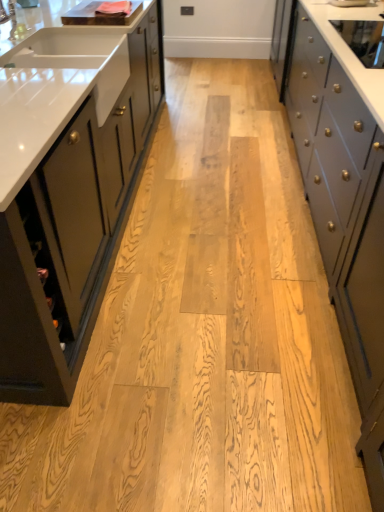
Describe the element at coordinates (67, 189) in the screenshot. I see `matte dark green cabinet at left, which ranks as the 1th cabinetry in left-to-right order` at that location.

This screenshot has height=512, width=384. What do you see at coordinates (341, 201) in the screenshot? I see `gray matte cabinet at right, acting as the second cabinetry starting from the left` at bounding box center [341, 201].

This screenshot has height=512, width=384. What are the coordinates of `silver metallic faucet at upper left` in the screenshot? It's located at (12, 23).

Looking at this image, how many degrees apart are the facing directions of matte dark green cabinet at left, the second cabinetry when ordered from right to left, and silver metallic faucet at upper left?

They differ by 2.26 degrees in their facing directions.

Is point (12, 330) less distant than point (13, 40)?

Yes, point (12, 330) is in front of point (13, 40).

I want to click on cabinetry that appears on the left of silver metallic faucet at upper left, so click(x=67, y=189).

Would you say silver metallic faucet at upper left contains gray matte cabinet at right, acting as the second cabinetry starting from the left?

That's incorrect, gray matte cabinet at right, acting as the second cabinetry starting from the left, is not inside silver metallic faucet at upper left.

Looking at this image, which is nearer, (15,32) or (280,98)?

Clearly, point (15,32) is closer to the camera than point (280,98).

From a real-world perspective, between silver metallic faucet at upper left and gray matte cabinet at right, acting as the second cabinetry starting from the left, who is vertically lower?

gray matte cabinet at right, acting as the second cabinetry starting from the left, is physically lower.

Considering the positions of objects silver metallic faucet at upper left and matte dark green cabinet at left, which ranks as the 1th cabinetry in left-to-right order, in the image provided, who is more to the left, silver metallic faucet at upper left or matte dark green cabinet at left, which ranks as the 1th cabinetry in left-to-right order,?

From the viewer's perspective, matte dark green cabinet at left, which ranks as the 1th cabinetry in left-to-right order, appears more on the left side.

Based on the photo, from a real-world perspective, is silver metallic faucet at upper left positioned over matte dark green cabinet at left, the second cabinetry when ordered from right to left, based on gravity?

Correct, in the physical world, silver metallic faucet at upper left is higher than matte dark green cabinet at left, the second cabinetry when ordered from right to left.

Between silver metallic faucet at upper left and matte dark green cabinet at left, the second cabinetry when ordered from right to left, which one has larger width?

With larger width is matte dark green cabinet at left, the second cabinetry when ordered from right to left.

Does point (8, 4) come farther from viewer compared to point (87, 94)?

Yes, it is.

Is gray matte cabinet at right, acting as the second cabinetry starting from the left, taller or shorter than matte dark green cabinet at left, which ranks as the 1th cabinetry in left-to-right order?

gray matte cabinet at right, acting as the second cabinetry starting from the left, is taller than matte dark green cabinet at left, which ranks as the 1th cabinetry in left-to-right order.

Where is `cabinetry lying on the right of matte dark green cabinet at left, which ranks as the 1th cabinetry in left-to-right order`? The height and width of the screenshot is (512, 384). cabinetry lying on the right of matte dark green cabinet at left, which ranks as the 1th cabinetry in left-to-right order is located at coordinates (341, 201).

Is gray matte cabinet at right, acting as the second cabinetry starting from the left, inside or outside of matte dark green cabinet at left, the second cabinetry when ordered from right to left?

gray matte cabinet at right, acting as the second cabinetry starting from the left, exists outside the volume of matte dark green cabinet at left, the second cabinetry when ordered from right to left.

The width and height of the screenshot is (384, 512). I want to click on cabinetry on the right of matte dark green cabinet at left, the second cabinetry when ordered from right to left, so click(x=341, y=201).

How many degrees apart are the facing directions of matte dark green cabinet at left, which ranks as the 1th cabinetry in left-to-right order, and gray matte cabinet at right, which appears as the first cabinetry when viewed from the right?

They differ by 0.163 degrees in their facing directions.

From the image's perspective, is matte dark green cabinet at left, the second cabinetry when ordered from right to left, positioned above or below gray matte cabinet at right, which appears as the first cabinetry when viewed from the right?

Clearly, from the image's perspective, matte dark green cabinet at left, the second cabinetry when ordered from right to left, is above gray matte cabinet at right, which appears as the first cabinetry when viewed from the right.

From a real-world perspective, relative to gray matte cabinet at right, acting as the second cabinetry starting from the left, is matte dark green cabinet at left, which ranks as the 1th cabinetry in left-to-right order, vertically above or below?

matte dark green cabinet at left, which ranks as the 1th cabinetry in left-to-right order, is situated lower than gray matte cabinet at right, acting as the second cabinetry starting from the left, in the real world.

Which is in front, point (327, 185) or point (6, 26)?

The point (327, 185) is more forward.

Can you confirm if gray matte cabinet at right, which appears as the first cabinetry when viewed from the right, is taller than silver metallic faucet at upper left?

Indeed, gray matte cabinet at right, which appears as the first cabinetry when viewed from the right, has a greater height compared to silver metallic faucet at upper left.

From a real-world perspective, is gray matte cabinet at right, acting as the second cabinetry starting from the left, over silver metallic faucet at upper left?

No, from a real-world perspective, gray matte cabinet at right, acting as the second cabinetry starting from the left, is not on top of silver metallic faucet at upper left.

Considering their positions, is gray matte cabinet at right, acting as the second cabinetry starting from the left, located in front of or behind silver metallic faucet at upper left?

In the image, gray matte cabinet at right, acting as the second cabinetry starting from the left, appears in front of silver metallic faucet at upper left.

Find the location of a particular element. Image resolution: width=384 pixels, height=512 pixels. faucet above the matte dark green cabinet at left, which ranks as the 1th cabinetry in left-to-right order (from a real-world perspective) is located at coordinates (12, 23).

From a real-world perspective, starting from the silver metallic faucet at upper left, which cabinetry is the 1st one below it? Please provide its 2D coordinates.

[(341, 201)]

Estimate the real-world distances between objects in this image. Which object is closer to matte dark green cabinet at left, which ranks as the 1th cabinetry in left-to-right order, silver metallic faucet at upper left or gray matte cabinet at right, which appears as the first cabinetry when viewed from the right?

silver metallic faucet at upper left is positioned closer to the anchor matte dark green cabinet at left, which ranks as the 1th cabinetry in left-to-right order.

Estimate the real-world distances between objects in this image. Which object is closer to gray matte cabinet at right, which appears as the first cabinetry when viewed from the right, silver metallic faucet at upper left or matte dark green cabinet at left, the second cabinetry when ordered from right to left?

matte dark green cabinet at left, the second cabinetry when ordered from right to left, lies closer to gray matte cabinet at right, which appears as the first cabinetry when viewed from the right, than the other object.

When comparing their distances from silver metallic faucet at upper left, does matte dark green cabinet at left, the second cabinetry when ordered from right to left, or gray matte cabinet at right, acting as the second cabinetry starting from the left, seem closer?

matte dark green cabinet at left, the second cabinetry when ordered from right to left, lies closer to silver metallic faucet at upper left than the other object.

From the image, which object appears to be farther from gray matte cabinet at right, acting as the second cabinetry starting from the left, matte dark green cabinet at left, which ranks as the 1th cabinetry in left-to-right order, or silver metallic faucet at upper left?

silver metallic faucet at upper left is further to gray matte cabinet at right, acting as the second cabinetry starting from the left.

Considering their positions, is gray matte cabinet at right, acting as the second cabinetry starting from the left, positioned closer to silver metallic faucet at upper left than matte dark green cabinet at left, which ranks as the 1th cabinetry in left-to-right order?

→ matte dark green cabinet at left, which ranks as the 1th cabinetry in left-to-right order, is closer to silver metallic faucet at upper left.

Estimate the real-world distances between objects in this image. Which object is further from matte dark green cabinet at left, which ranks as the 1th cabinetry in left-to-right order, gray matte cabinet at right, which appears as the first cabinetry when viewed from the right, or silver metallic faucet at upper left?

gray matte cabinet at right, which appears as the first cabinetry when viewed from the right.

Where is `faucet between matte dark green cabinet at left, which ranks as the 1th cabinetry in left-to-right order, and gray matte cabinet at right, which appears as the first cabinetry when viewed from the right, from left to right`? Image resolution: width=384 pixels, height=512 pixels. faucet between matte dark green cabinet at left, which ranks as the 1th cabinetry in left-to-right order, and gray matte cabinet at right, which appears as the first cabinetry when viewed from the right, from left to right is located at coordinates (12, 23).